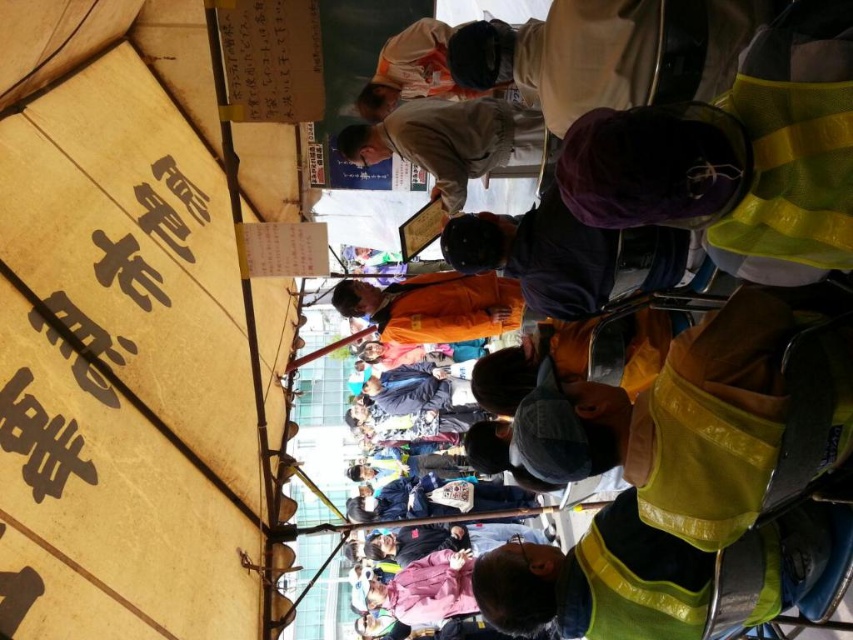
Question: Does yellow canvas canopy at upper left have a lesser width compared to khaki cotton shirt at center?

Choices:
 (A) yes
 (B) no

Answer: (A)

Question: Which of the following is the farthest from the observer?

Choices:
 (A) (212, 113)
 (B) (96, 189)

Answer: (A)

Question: Is yellow canvas canopy at upper left to the left of orange reflective vest at center from the viewer's perspective?

Choices:
 (A) yes
 (B) no

Answer: (A)

Question: Which of these objects is positioned closest to the khaki cotton shirt at center?

Choices:
 (A) orange fabric at center
 (B) orange reflective vest at center

Answer: (A)

Question: Where is orange reflective vest at center located in relation to khaki cotton shirt at center in the image?

Choices:
 (A) below
 (B) above

Answer: (A)

Question: Which is nearer to the yellow canvas canopy at upper left?

Choices:
 (A) khaki cotton shirt at center
 (B) orange reflective vest at center
 (C) brown paper sign at left
 (D) orange fabric at center

Answer: (C)